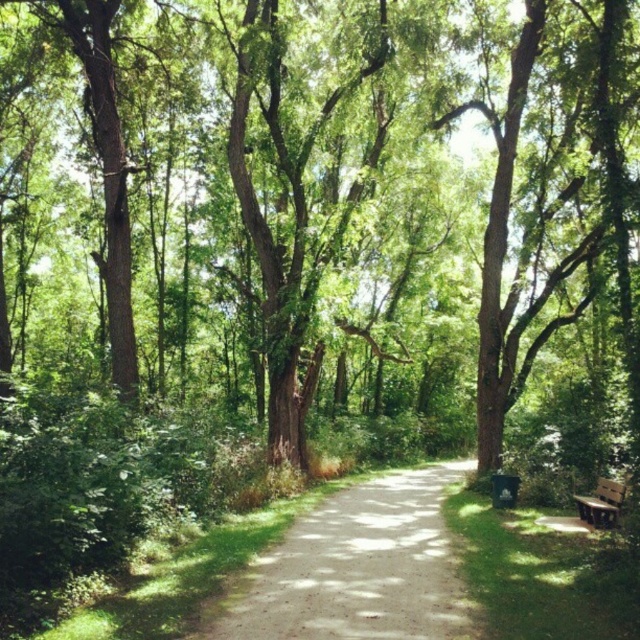
Consider the image. You are standing on the forest pathway and see two points marked on the ground. The first point is at coordinates point (333, 604) and the second is at point (605, 486). Which point is closer to you?

Point (333, 604) is closer to the viewer than point (605, 486).